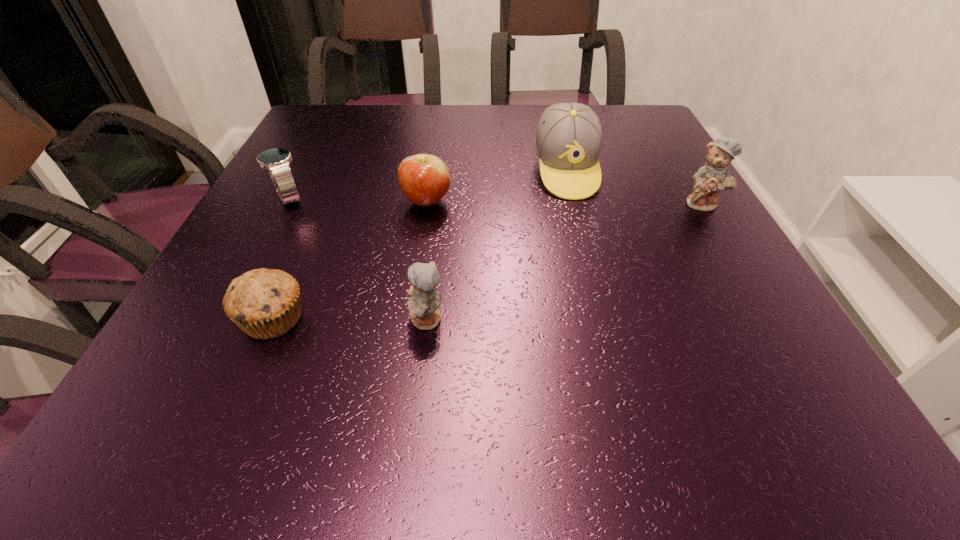
Identify the location of the shorter teddy bear. The height and width of the screenshot is (540, 960). (423, 305).

Locate an element on the screen. The height and width of the screenshot is (540, 960). the nearer teddy bear is located at coordinates (423, 305).

Identify the location of the farther teddy bear. (715, 176).

Where is `the rightmost object`? The image size is (960, 540). the rightmost object is located at coordinates (715, 176).

Image resolution: width=960 pixels, height=540 pixels. In order to click on apple in this screenshot , I will do `click(424, 179)`.

The height and width of the screenshot is (540, 960). In order to click on watch in this screenshot , I will do `click(277, 161)`.

Identify the location of baseball cap. (568, 140).

Locate an element on the screen. The height and width of the screenshot is (540, 960). muffin is located at coordinates pyautogui.click(x=265, y=303).

The height and width of the screenshot is (540, 960). I want to click on free spot located on the front-facing side of the left teddy bear, so click(x=318, y=320).

Identify the location of vacant space located on the front-facing side of the left teddy bear. (305, 320).